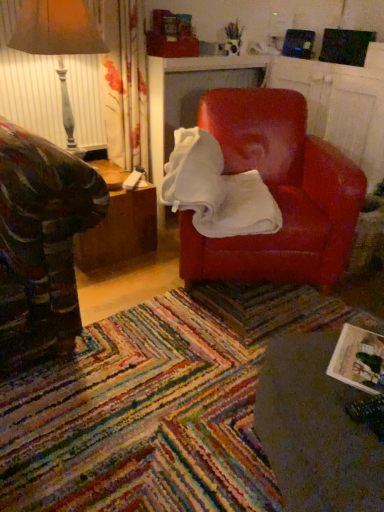
Question: Is woodenmaterial/texturetable at left, the first table when ordered from back to front, next to matte gray table lamp at left?

Choices:
 (A) no
 (B) yes

Answer: (A)

Question: From a real-world perspective, is woodenmaterial/texturetable at left, the first table when ordered from back to front, positioned over matte gray table lamp at left based on gravity?

Choices:
 (A) yes
 (B) no

Answer: (B)

Question: Does woodenmaterial/texturetable at left, arranged as the second table when viewed from the front, have a greater height compared to matte gray table lamp at left?

Choices:
 (A) yes
 (B) no

Answer: (B)

Question: From the image's perspective, is woodenmaterial/texturetable at left, arranged as the second table when viewed from the front, below matte gray table lamp at left?

Choices:
 (A) no
 (B) yes

Answer: (B)

Question: Can you confirm if woodenmaterial/texturetable at left, the second table positioned from the bottom, is positioned to the right of matte gray table lamp at left?

Choices:
 (A) yes
 (B) no

Answer: (A)

Question: Can you confirm if woodenmaterial/texturetable at left, the second table positioned from the bottom, is smaller than matte gray table lamp at left?

Choices:
 (A) yes
 (B) no

Answer: (A)

Question: Is matte white magazine at lower right to the left of matte gray table lamp at left from the viewer's perspective?

Choices:
 (A) yes
 (B) no

Answer: (B)

Question: Would you say matte white magazine at lower right contains matte gray table lamp at left?

Choices:
 (A) no
 (B) yes

Answer: (A)

Question: Is matte white magazine at lower right aimed at matte gray table lamp at left?

Choices:
 (A) no
 (B) yes

Answer: (A)

Question: Is matte white magazine at lower right smaller than matte gray table lamp at left?

Choices:
 (A) no
 (B) yes

Answer: (B)

Question: Can you confirm if matte white magazine at lower right is taller than matte gray table lamp at left?

Choices:
 (A) yes
 (B) no

Answer: (B)

Question: From a real-world perspective, is matte white magazine at lower right below matte gray table lamp at left?

Choices:
 (A) no
 (B) yes

Answer: (B)

Question: Is matte leather chair at center further to the viewer compared to matte gray table lamp at left?

Choices:
 (A) yes
 (B) no

Answer: (B)